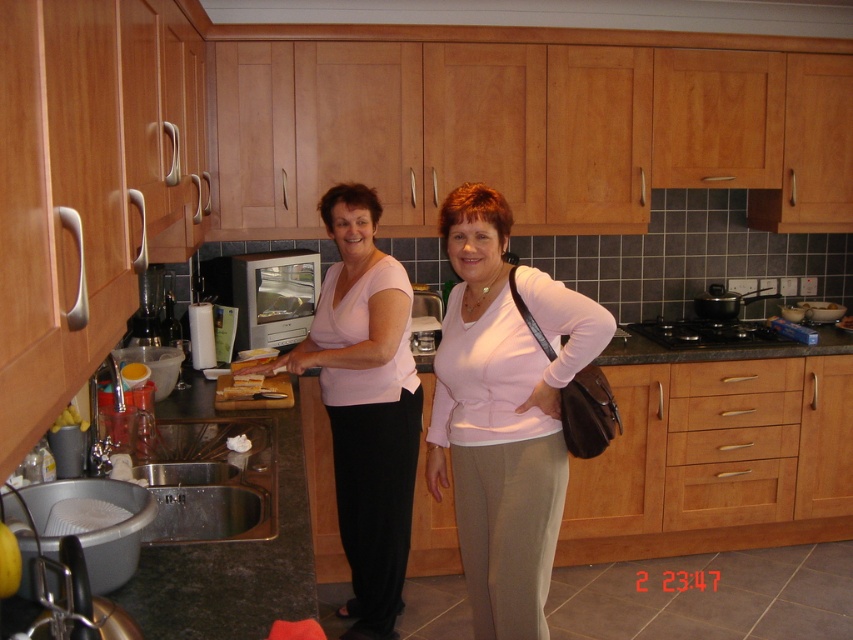
Question: Which point appears closest to the camera in this image?

Choices:
 (A) (239, 368)
 (B) (376, 220)

Answer: (B)

Question: Is pink matte sweater at center wider than yellow bread at center?

Choices:
 (A) yes
 (B) no

Answer: (A)

Question: Does pink matte sweater at center have a lesser width compared to light brown wood drawer at lower center?

Choices:
 (A) no
 (B) yes

Answer: (B)

Question: Which point is closer to the camera?

Choices:
 (A) (164, 573)
 (B) (784, 362)
 (C) (358, 410)
 (D) (271, 374)

Answer: (A)

Question: Which object appears closest to the camera in this image?

Choices:
 (A) pink matte shirt at center
 (B) yellow bread at center
 (C) wooden drawer at center

Answer: (A)

Question: Can you confirm if pink matte shirt at center is positioned below stainless steel sink at lower left?

Choices:
 (A) yes
 (B) no

Answer: (B)